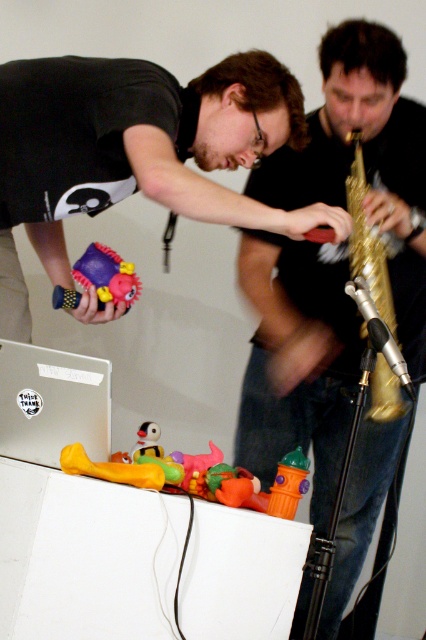
You are a photographer standing at the camera position. You want to take a closeup shot of the yellow rubber duck at lower left. Can you reach it without moving your feet? Your arms can extend up to 1.2 meters.

The yellow rubber duck at lower left is 1.22 meters away from camera. Since your arms can extend up to 1.2 meters, you cannot reach it without moving your feet.

You are standing at the point marked by coordinates point (x=111, y=468). Looking at the scene, which object is located at your current position?

The yellow rubber duck at lower left is located at point (x=111, y=468).